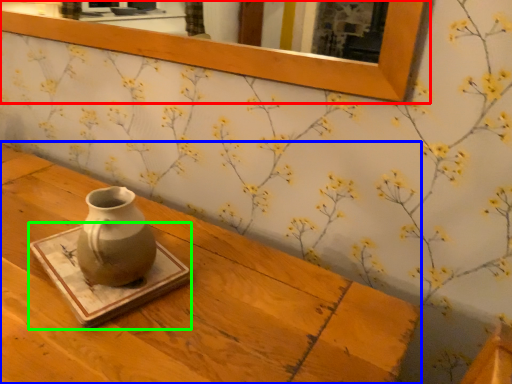
Question: Which object is the closest to the picture frame (highlighted by a red box)? Choose among these: table (highlighted by a blue box) or tray (highlighted by a green box).

Choices:
 (A) table
 (B) tray

Answer: (A)